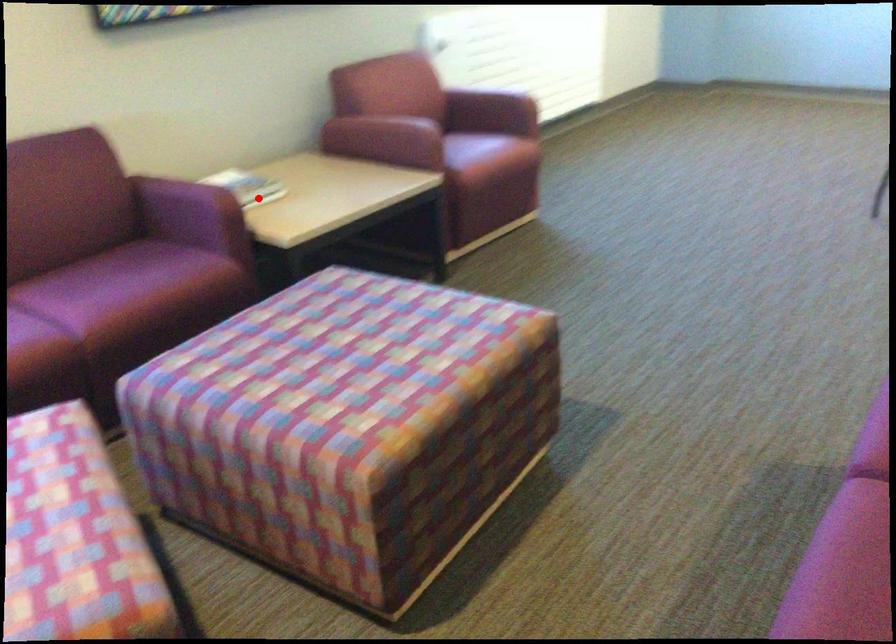
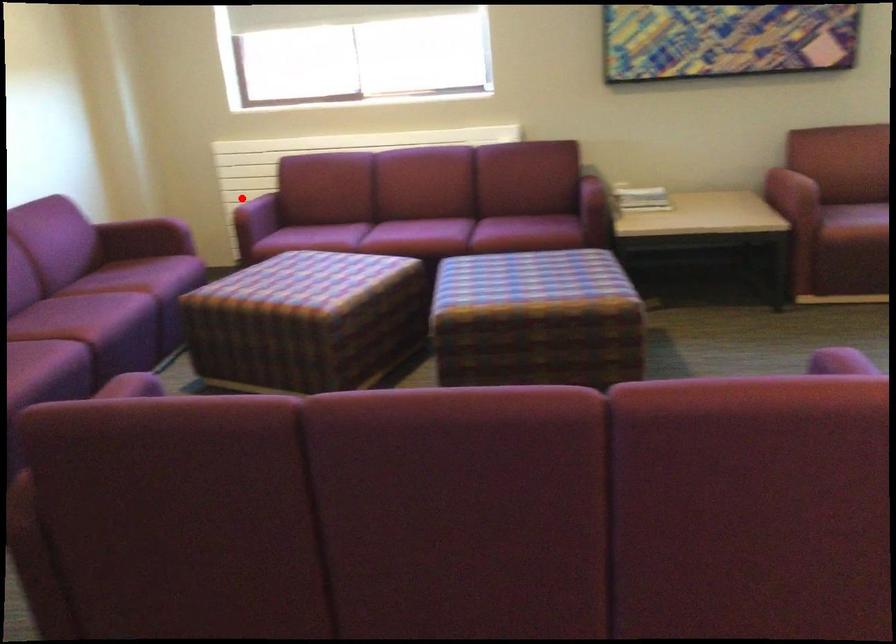
I am providing you with two images of the same scene from different viewpoints. A red point is marked on the first image and another point is marked on the second image. Is the marked point in image1 the same physical position as the marked point in image2?

No